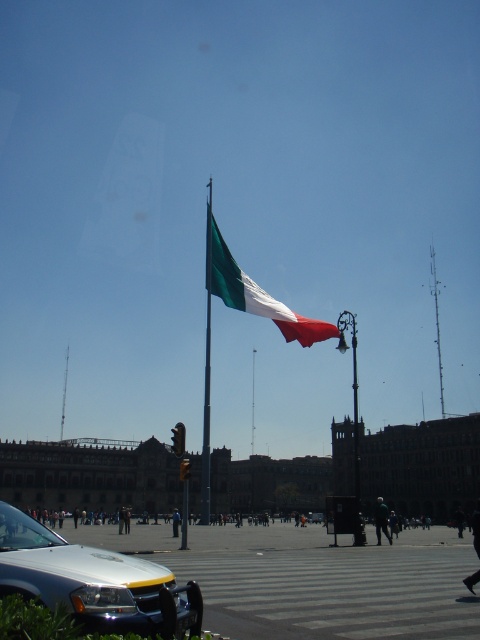
You are standing at the point with coordinates 0.5, 0.5 in the image. Which direction should you move to reach the metallic flag pole at center?

The metallic flag pole at center is located at point (206, 372). Since you are at (240, 320), you should move northeast to reach it.

You are a photographer trying to capture a wide shot of the scene. The silver metallic car at lower left and the metallic tower at upper center are both in your frame. Which object takes up more horizontal space in the photo?

The silver metallic car at lower left takes up more horizontal space in the photo because its width surpasses that of the metallic tower at upper center.